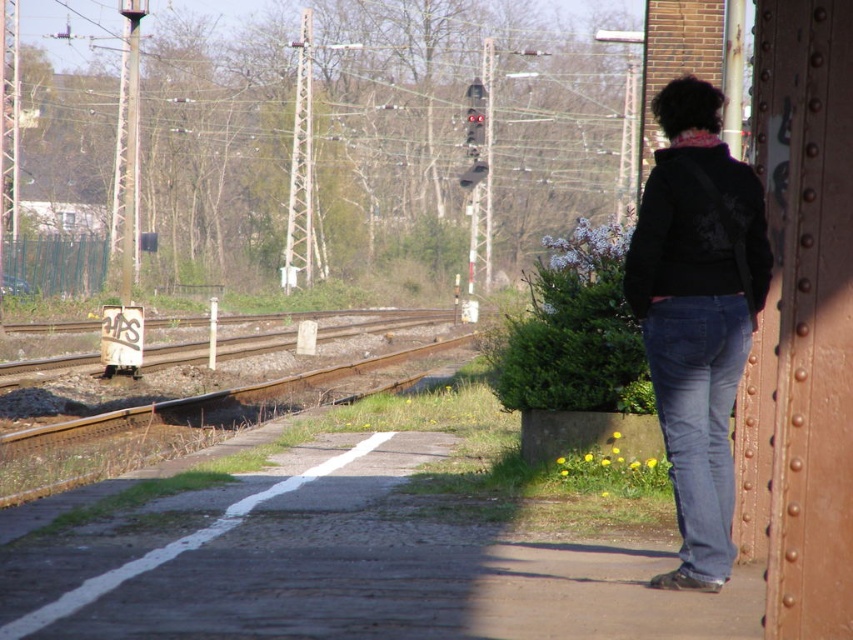
Question: Which of the following is the closest to the observer?

Choices:
 (A) rusty metal track at left
 (B) dark blue jeans at right

Answer: (B)

Question: Is the position of dark blue jeans at right more distant than that of rusty metal track at left?

Choices:
 (A) yes
 (B) no

Answer: (B)

Question: Which point appears farthest from the camera in this image?

Choices:
 (A) (393, 317)
 (B) (54, 444)

Answer: (A)

Question: Does dark blue jeans at right appear under rusty metal track at left?

Choices:
 (A) yes
 (B) no

Answer: (B)

Question: Considering the relative positions of rusty metal track at left and rusty metal train track at center in the image provided, where is rusty metal track at left located with respect to rusty metal train track at center?

Choices:
 (A) left
 (B) right

Answer: (B)

Question: Which is nearer to the rusty metal train track at center?

Choices:
 (A) rusty metal track at left
 (B) dark blue jeans at right

Answer: (A)